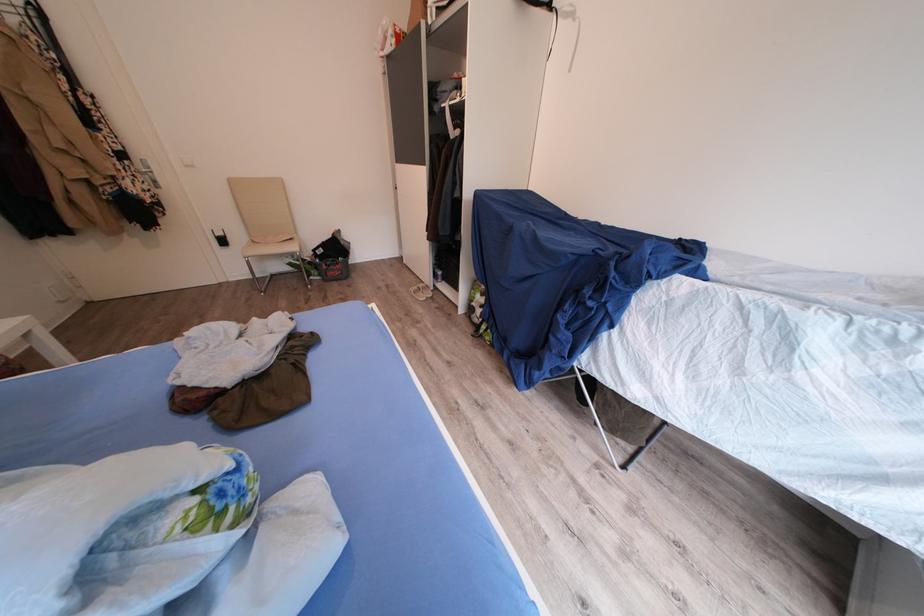
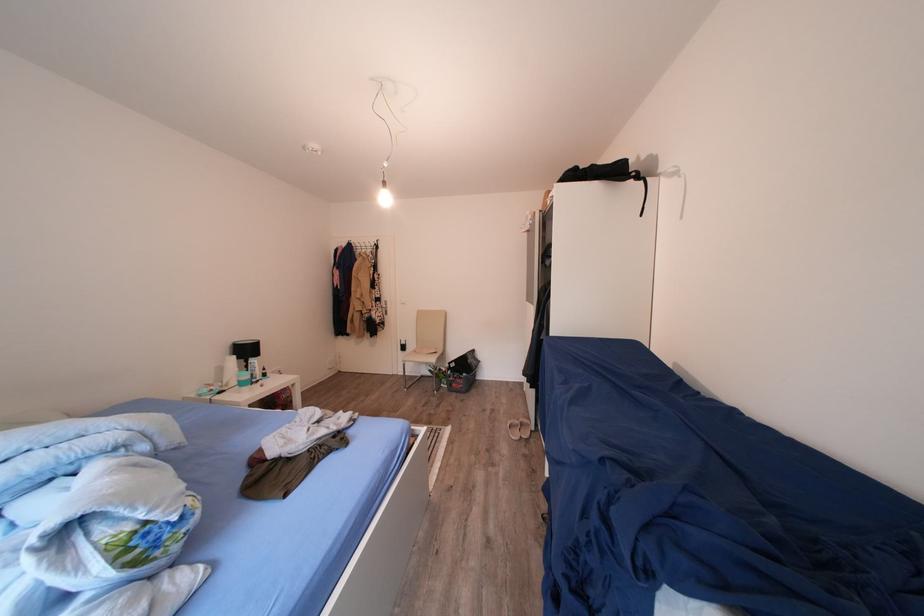
How did the camera likely rotate?

The camera's rotation is toward left-up.